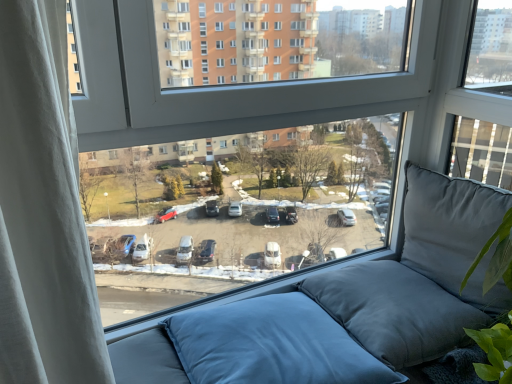
Question: Could you tell me if transparent glass window at center is turned towards blue fabric pillow at lower center, which ranks as the 2th pillow in right-to-left order?

Choices:
 (A) yes
 (B) no

Answer: (A)

Question: Is blue fabric pillow at lower center, which ranks as the 2th pillow in right-to-left order, located within transparent glass window at center?

Choices:
 (A) yes
 (B) no

Answer: (B)

Question: Considering the relative positions of transparent glass window at center and blue fabric pillow at lower center, which ranks as the 2th pillow in right-to-left order, in the image provided, is transparent glass window at center to the right of blue fabric pillow at lower center, which ranks as the 2th pillow in right-to-left order, from the viewer's perspective?

Choices:
 (A) no
 (B) yes

Answer: (B)

Question: Does transparent glass window at center have a smaller size compared to blue fabric pillow at lower center, which ranks as the 2th pillow in right-to-left order?

Choices:
 (A) yes
 (B) no

Answer: (B)

Question: Does transparent glass window at center have a greater width compared to blue fabric pillow at lower center, which ranks as the 2th pillow in right-to-left order?

Choices:
 (A) no
 (B) yes

Answer: (A)

Question: Which is correct: matte gray cushion at right, positioned as the second pillow in left-to-right order, is inside transparent glass window at center, or outside of it?

Choices:
 (A) inside
 (B) outside

Answer: (B)

Question: From a real-world perspective, is matte gray cushion at right, positioned as the second pillow in left-to-right order, positioned above or below transparent glass window at center?

Choices:
 (A) above
 (B) below

Answer: (B)

Question: Considering the positions of matte gray cushion at right, marked as the 1th pillow in a right-to-left arrangement, and transparent glass window at center in the image, is matte gray cushion at right, marked as the 1th pillow in a right-to-left arrangement, wider or thinner than transparent glass window at center?

Choices:
 (A) thin
 (B) wide

Answer: (B)

Question: Would you say matte gray cushion at right, positioned as the second pillow in left-to-right order, is to the left or to the right of transparent glass window at center in the picture?

Choices:
 (A) right
 (B) left

Answer: (A)

Question: In terms of height, does blue fabric pillow at lower center, which ranks as the 2th pillow in right-to-left order, look taller or shorter compared to matte gray cushion at right, marked as the 1th pillow in a right-to-left arrangement?

Choices:
 (A) tall
 (B) short

Answer: (B)

Question: Is blue fabric pillow at lower center, which ranks as the 2th pillow in right-to-left order, to the left or to the right of matte gray cushion at right, marked as the 1th pillow in a right-to-left arrangement, in the image?

Choices:
 (A) left
 (B) right

Answer: (A)

Question: From the image's perspective, relative to matte gray cushion at right, positioned as the second pillow in left-to-right order, is blue fabric pillow at lower center, which ranks as the 2th pillow in right-to-left order, above or below?

Choices:
 (A) below
 (B) above

Answer: (A)

Question: Considering the positions of point (208, 339) and point (437, 190), is point (208, 339) closer or farther from the camera than point (437, 190)?

Choices:
 (A) farther
 (B) closer

Answer: (B)

Question: From their relative heights in the image, would you say transparent glass window at center is taller or shorter than blue fabric pillow at lower center, which ranks as the 2th pillow in right-to-left order?

Choices:
 (A) tall
 (B) short

Answer: (A)

Question: Does point (159, 129) appear closer or farther from the camera than point (218, 380)?

Choices:
 (A) closer
 (B) farther

Answer: (B)